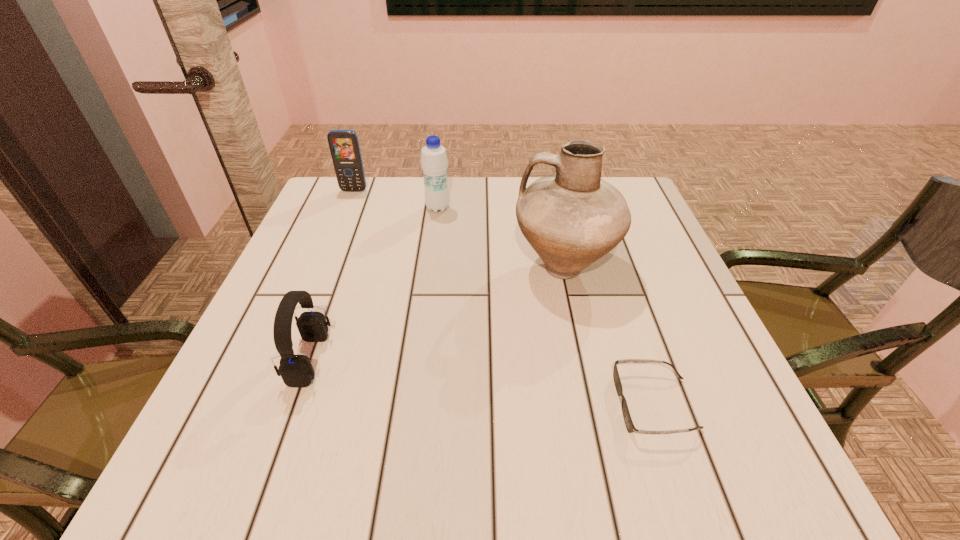
The width and height of the screenshot is (960, 540). I want to click on the third nearest object, so point(571,218).

Locate an element on the screen. the tallest object is located at coordinates (571, 218).

Where is `the third object from right to left`? the third object from right to left is located at coordinates (434, 160).

Identify the location of water bottle. (434, 160).

In order to click on the farthest object in this screenshot , I will do `click(344, 146)`.

Where is `the second shortest object`? the second shortest object is located at coordinates coord(296,370).

The width and height of the screenshot is (960, 540). In order to click on the shortest object in this screenshot , I will do `click(629, 424)`.

Image resolution: width=960 pixels, height=540 pixels. Identify the location of vacant region located 0.400m on the handle side of the pitcher. (336, 267).

The width and height of the screenshot is (960, 540). Find the location of `free space located on the handle side of the pitcher`. free space located on the handle side of the pitcher is located at coordinates (402, 267).

Where is `vacant space situated 0.050m on the handle side of the pitcher`? The height and width of the screenshot is (540, 960). vacant space situated 0.050m on the handle side of the pitcher is located at coordinates click(491, 267).